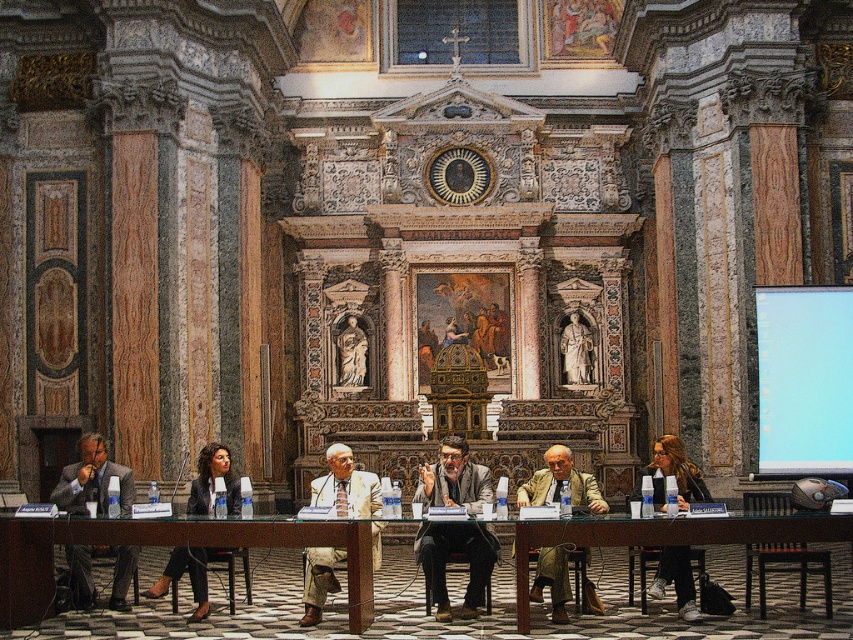
Does khaki corduroy pants at center have a lesser width compared to polished marble statue at center?

Incorrect, khaki corduroy pants at center's width is not less than polished marble statue at center's.

Does khaki corduroy pants at center appear over polished marble statue at center?

Actually, khaki corduroy pants at center is below polished marble statue at center.

Which is behind, point (543, 561) or point (579, 352)?

The point (579, 352) is behind.

Locate an element on the screen. Image resolution: width=853 pixels, height=640 pixels. khaki corduroy pants at center is located at coordinates (561, 483).

This screenshot has height=640, width=853. Describe the element at coordinates (456, 552) in the screenshot. I see `gray wool suit at center` at that location.

Between gray wool suit at center and light beige suit at center, which one appears on the right side from the viewer's perspective?

Positioned to the right is gray wool suit at center.

Is point (453, 548) less distant than point (361, 500)?

Yes.

I want to click on gray wool suit at center, so click(456, 552).

Does glass table at center appear on the left side of wooden polished table at lower right?

Indeed, glass table at center is positioned on the left side of wooden polished table at lower right.

Which is in front, point (196, 630) or point (573, 544)?

Point (573, 544) is in front.

In order to click on glass table at center in this screenshot , I will do `click(254, 580)`.